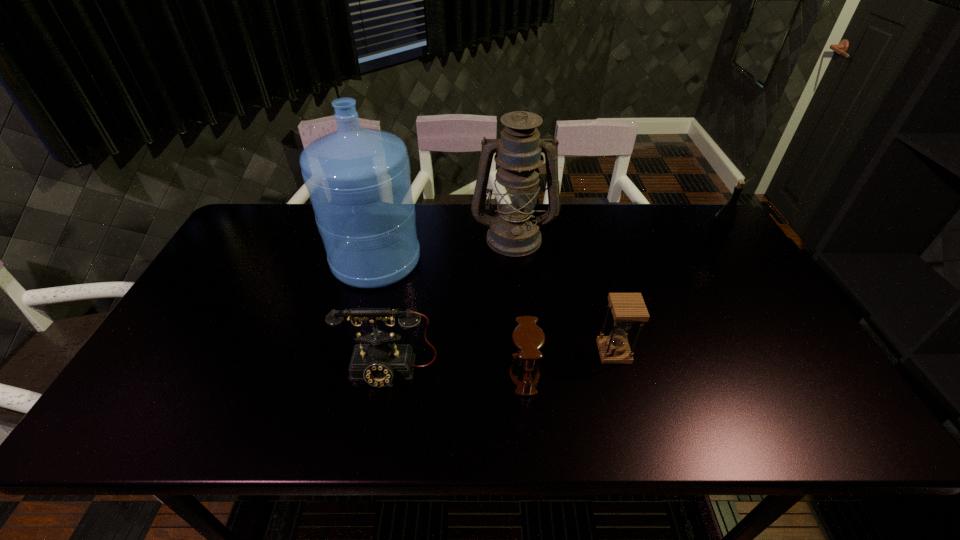
Find the location of a particular element. free space that satisfies the following two spatial constraints: 1. on the side of the water jug with the handle; 2. on the left side of the beer bottle is located at coordinates (379, 247).

What are the coordinates of `free space that satisfies the following two spatial constraints: 1. on the back side of the rightmost object; 2. on the left side of the second shortest object` in the screenshot? It's located at (585, 247).